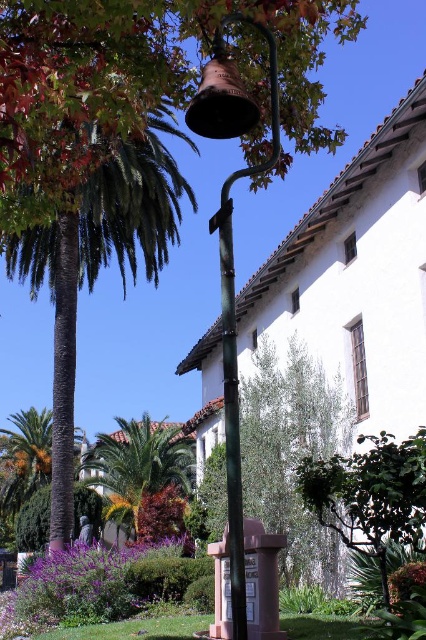
Question: Is green leafy palm tree at center to the right of bronze bell at upper center from the viewer's perspective?

Choices:
 (A) yes
 (B) no

Answer: (B)

Question: Which point is closer to the camera?

Choices:
 (A) green leafy palm tree at center
 (B) bronze bell at upper center
 (C) green matte pole at center

Answer: (C)

Question: Is green leafy palm tree at left bigger than green matte pole at center?

Choices:
 (A) yes
 (B) no

Answer: (A)

Question: Which object is farther from the camera taking this photo?

Choices:
 (A) bronze bell at upper center
 (B) green leafy palm tree at left

Answer: (B)

Question: Among these objects, which one is farthest from the camera?

Choices:
 (A) green leafy palm tree at left
 (B) green painted metal bell at center

Answer: (A)

Question: Is green leafy palm tree at center wider than green matte pole at center?

Choices:
 (A) yes
 (B) no

Answer: (A)